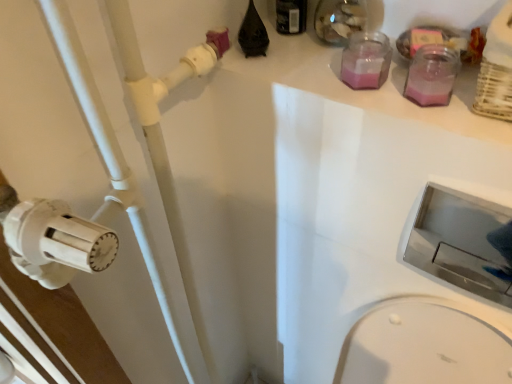
Question: Is white plastic pipe at left aimed at black plastic bottle at upper center, which is counted as the second bottle, starting from the bottom?

Choices:
 (A) no
 (B) yes

Answer: (A)

Question: From the image's perspective, does white plastic pipe at left appear higher than black plastic bottle at upper center, the first bottle in the left-to-right sequence?

Choices:
 (A) no
 (B) yes

Answer: (A)

Question: Considering the relative sizes of white plastic pipe at left and black plastic bottle at upper center, which is the first bottle in top-to-bottom order, in the image provided, is white plastic pipe at left shorter than black plastic bottle at upper center, which is the first bottle in top-to-bottom order,?

Choices:
 (A) no
 (B) yes

Answer: (A)

Question: From a real-world perspective, is white plastic pipe at left on black plastic bottle at upper center, which is the first bottle in top-to-bottom order?

Choices:
 (A) no
 (B) yes

Answer: (A)

Question: Is white plastic pipe at left at the right side of black plastic bottle at upper center, which is counted as the second bottle, starting from the bottom?

Choices:
 (A) yes
 (B) no

Answer: (B)

Question: Looking at the image, does pink glass jar at upper right, acting as the 1th bottle starting from the bottom, seem bigger or smaller compared to metallic silver sink at lower right?

Choices:
 (A) small
 (B) big

Answer: (A)

Question: Is point (415, 57) closer or farther from the camera than point (441, 249)?

Choices:
 (A) closer
 (B) farther

Answer: (A)

Question: From the image's perspective, relative to metallic silver sink at lower right, is pink glass jar at upper right, acting as the 1th bottle starting from the bottom, above or below?

Choices:
 (A) above
 (B) below

Answer: (A)

Question: From a real-world perspective, is pink glass jar at upper right, which ranks as the 1th bottle in right-to-left order, physically located above or below metallic silver sink at lower right?

Choices:
 (A) below
 (B) above

Answer: (B)

Question: Based on their positions, is white plastic pipe at left located to the left or right of black plastic bottle at upper center, which is counted as the second bottle, starting from the bottom?

Choices:
 (A) right
 (B) left

Answer: (B)

Question: Is white plastic pipe at left bigger or smaller than black plastic bottle at upper center, which is counted as the second bottle, starting from the bottom?

Choices:
 (A) small
 (B) big

Answer: (B)

Question: Is point (103, 211) closer or farther from the camera than point (296, 29)?

Choices:
 (A) closer
 (B) farther

Answer: (A)

Question: Which is correct: white plastic pipe at left is inside black plastic bottle at upper center, which is the 2th bottle in right-to-left order, or outside of it?

Choices:
 (A) outside
 (B) inside

Answer: (A)

Question: In terms of width, does white plastic pipe at left look wider or thinner when compared to metallic silver sink at lower right?

Choices:
 (A) wide
 (B) thin

Answer: (A)

Question: Is white plastic pipe at left bigger or smaller than metallic silver sink at lower right?

Choices:
 (A) small
 (B) big

Answer: (B)